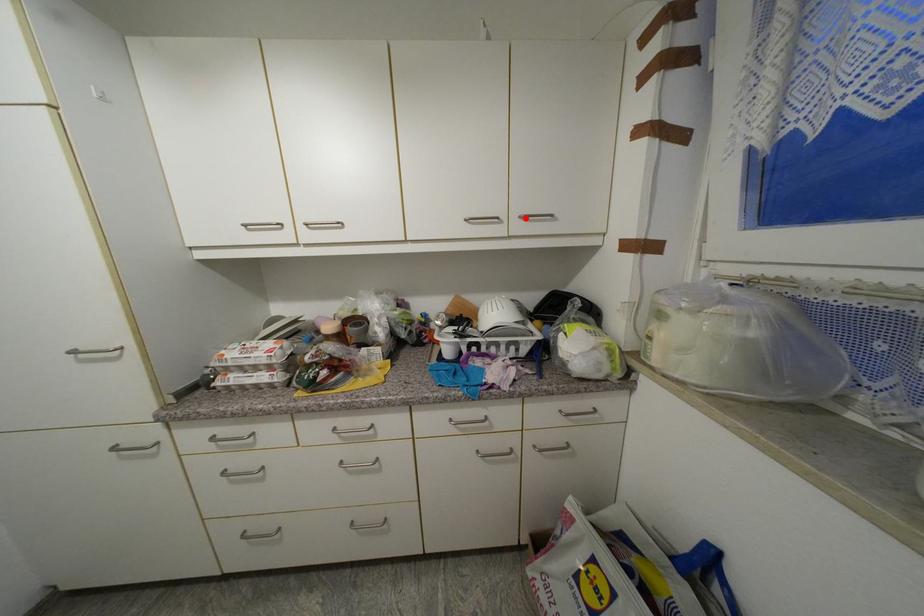
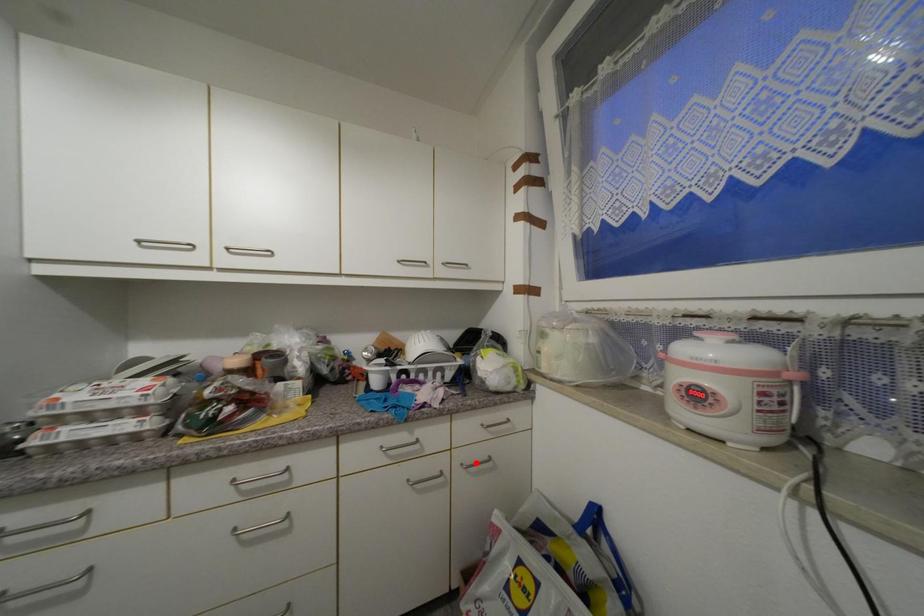
From the picture: I am providing you with two images of the same scene from different viewpoints. A red point is marked on the first image and another point is marked on the second image. Are the points marked in image1 and image2 representing the same 3D position?

No